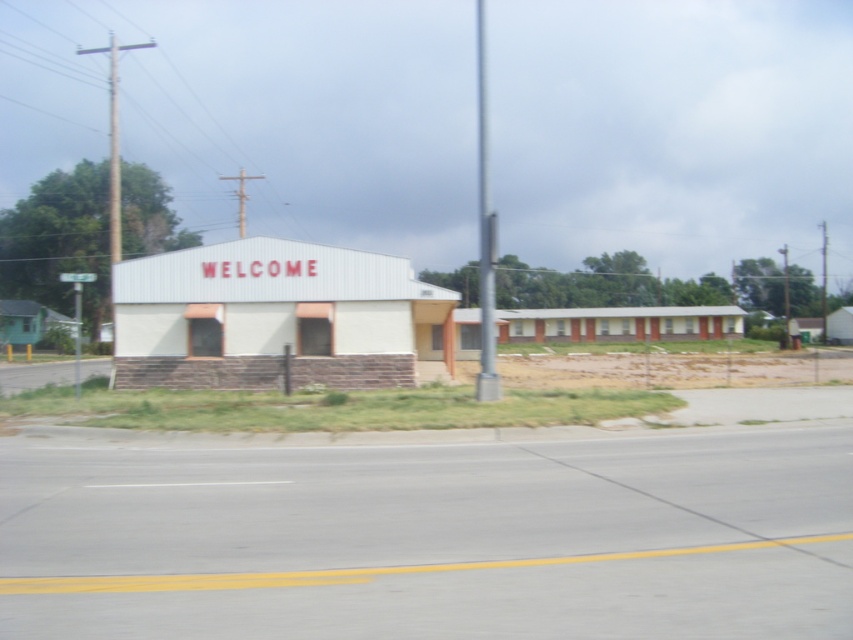
Question: Does white matte building at center lie behind metallic gray pole at center?

Choices:
 (A) no
 (B) yes

Answer: (B)

Question: Among these objects, which one is nearest to the camera?

Choices:
 (A) white matte building at center
 (B) metallic gray pole at center

Answer: (B)

Question: Can you confirm if white matte building at center is bigger than metallic gray pole at center?

Choices:
 (A) yes
 (B) no

Answer: (B)

Question: Is white matte building at center positioned behind metallic gray pole at center?

Choices:
 (A) no
 (B) yes

Answer: (B)

Question: Which of the following is the closest to the observer?

Choices:
 (A) (148, 304)
 (B) (482, 244)

Answer: (B)